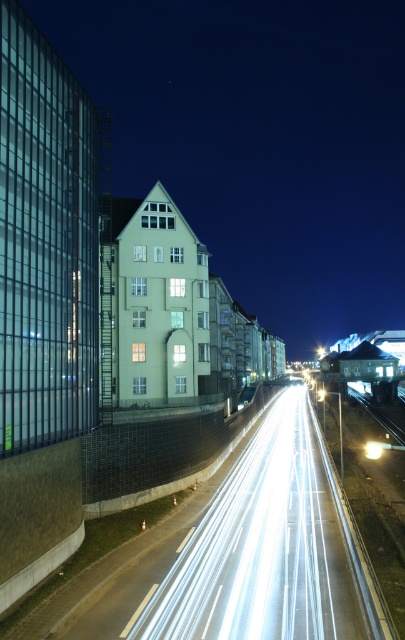
Which is more to the right, metallic silver car at center or white glossy light at center?

From the viewer's perspective, white glossy light at center appears more on the right side.

Does metallic silver car at center appear on the right side of white glossy light at center?

Incorrect, metallic silver car at center is not on the right side of white glossy light at center.

Is point (255, 390) positioned before point (377, 451)?

No, (255, 390) is further to viewer.

Where is `metallic silver car at center`? This screenshot has height=640, width=405. metallic silver car at center is located at coordinates (247, 396).

In the scene shown: Is white glossy highway at center above metallic silver car at center?

No.

Which is in front, point (334, 532) or point (245, 403)?

Point (334, 532) is in front.

Locate an element on the screen. The height and width of the screenshot is (640, 405). white glossy highway at center is located at coordinates (272, 548).

Measure the distance from white glossy highway at center to white glossy light at center.

white glossy highway at center is 12.60 meters away from white glossy light at center.

Does white glossy highway at center have a smaller size compared to white glossy light at center?

No, white glossy highway at center is not smaller than white glossy light at center.

Who is more distant from viewer, [275,582] or [368,456]?

The point [368,456] is behind.

The image size is (405, 640). In order to click on white glossy highway at center in this screenshot , I will do [272, 548].